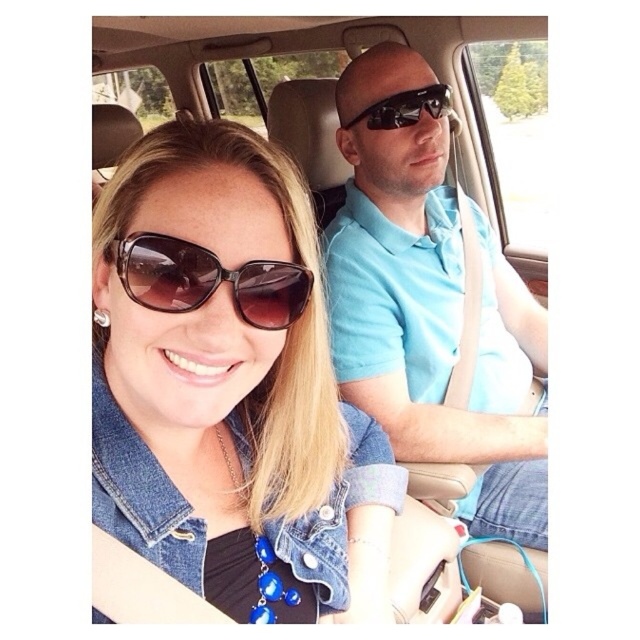
You are a passenger in the car and want to hand the driver the brown matte sunglasses at center and the black reflective sunglasses at upper center. Which pair should you hand first to the driver since they are closer?

The brown matte sunglasses at center should be handed first because it is closer to the viewer than the black reflective sunglasses at upper center.

You are a passenger in the car and want to hand a snack to the driver. The snack is currently on the dashboard. Which object, the light blue polo shirt at center or the brown matte sunglasses at center, is closer to your hand when reaching for the snack?

The brown matte sunglasses at center is closer to your hand when reaching for the snack because the light blue polo shirt at center is above it, meaning the sunglasses are positioned lower and thus nearer to the hand reaching from the passenger seat.